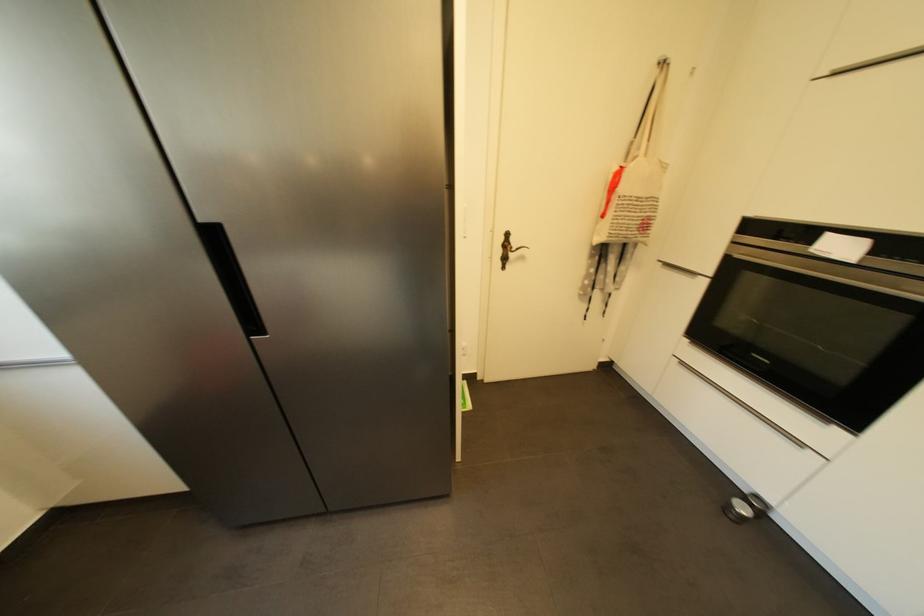
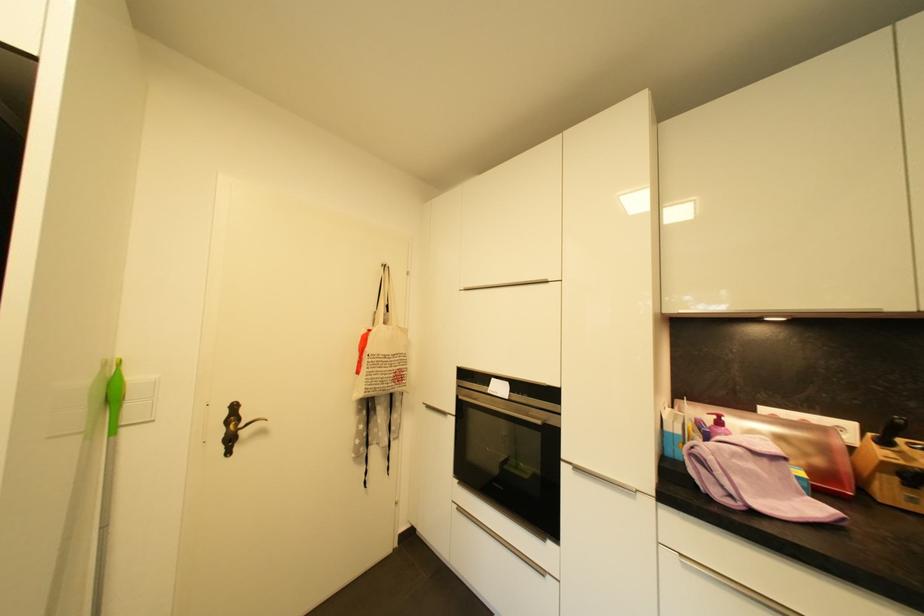
Find the pixel in the second image that matches pixel 687 365 in the first image.

(465, 511)